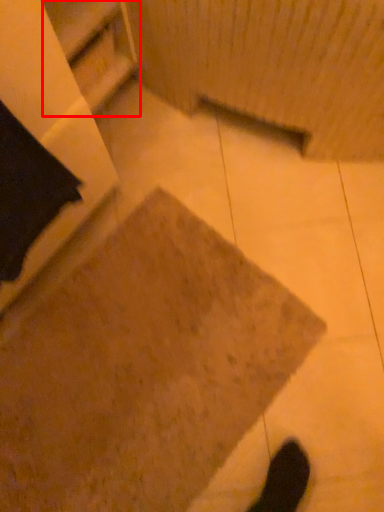
Question: From the image, what is the correct spatial relationship of shelf (annotated by the red box) in relation to concrete?

Choices:
 (A) right
 (B) left

Answer: (B)